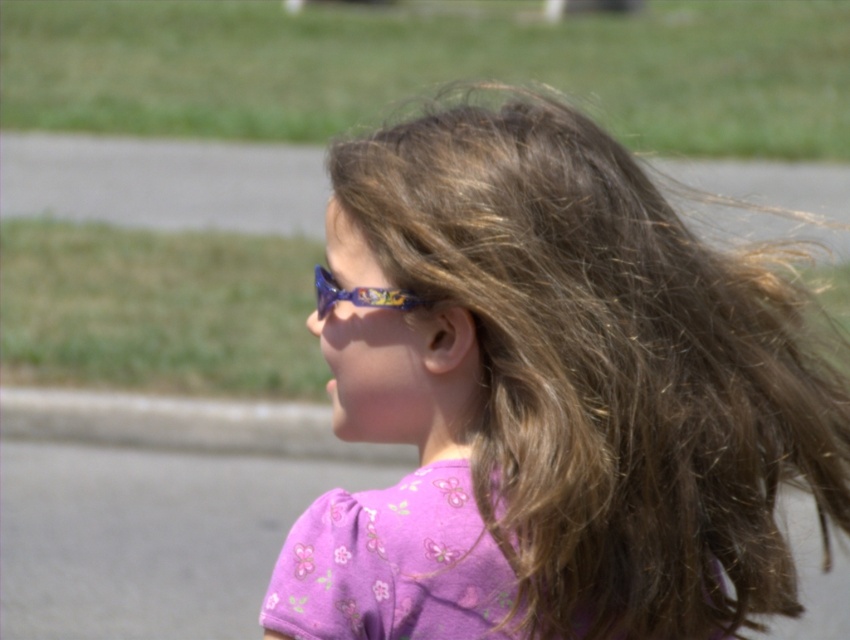
You are a fashion designer trying to create a new line of clothing and accessories. You want to ensure that the distance between the purple fabric shirt at center and the shiny blue plastic goggles at center on your mannequin model is exactly 25 centimeters. Based on the image provided, is the current positioning of these items meeting your design specifications?

The distance between the purple fabric shirt at center and the shiny blue plastic goggles at center is 24.54 centimeters, which is slightly less than the desired 25 centimeters. Therefore, the current positioning does not fully meet the design specifications.

You are a photographer trying to capture the girl in the image. Since the purple fabric shirt at center and the shiny blue plastic goggles at center are both at the center, which one is closer to the camera?

The purple fabric shirt at center is in front of the shiny blue plastic goggles at center, so the purple fabric shirt at center is closer to the camera.

You are a photographer adjusting your camera settings to capture the girl in the scene. You notice the purple fabric shirt at center and the shiny blue plastic goggles at center. Which object should you focus on first if you want to ensure both are in sharp focus, considering their positions?

The purple fabric shirt at center is much taller than the shiny blue plastic goggles at center, so focusing on the purple fabric shirt at center first would ensure both are in sharp focus due to its greater distance from the camera.